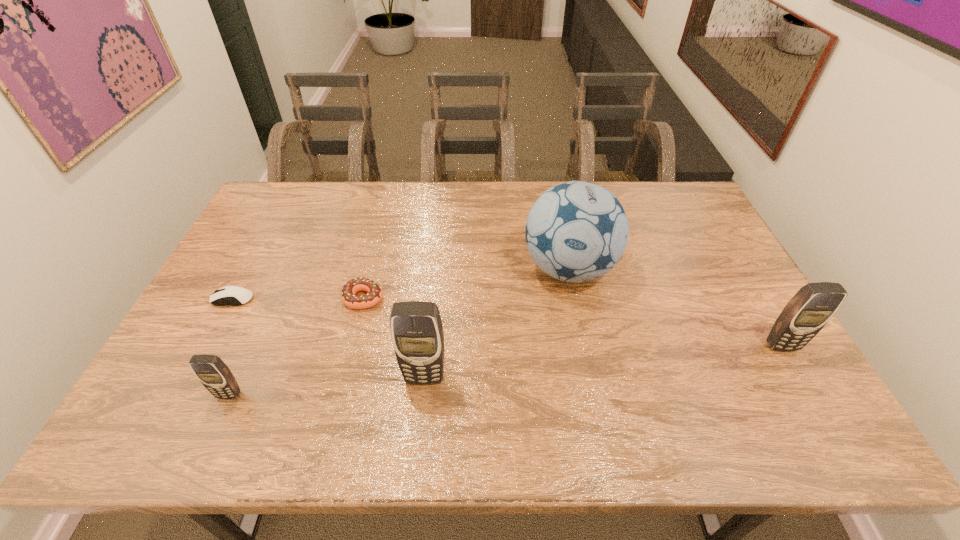
Find the location of `free point between the soccer ball and the leftmost object`. free point between the soccer ball and the leftmost object is located at coordinates (401, 284).

Where is `free space between the third shortest object and the fifth tallest object`? Image resolution: width=960 pixels, height=540 pixels. free space between the third shortest object and the fifth tallest object is located at coordinates (297, 346).

Where is `free space that is in between the second nearest object and the mouse`? This screenshot has height=540, width=960. free space that is in between the second nearest object and the mouse is located at coordinates (329, 338).

Locate which object is the fourth closest to the mouse. Please provide its 2D coordinates. Your answer should be formatted as a tuple, i.e. [(x, y)], where the tuple contains the x and y coordinates of a point satisfying the conditions above.

[(576, 231)]

Where is `object that is the second nearest to the second object from right to left`? The width and height of the screenshot is (960, 540). object that is the second nearest to the second object from right to left is located at coordinates (810, 309).

Identify which cellular telephone is located as the third nearest to the mouse. Please provide its 2D coordinates. Your answer should be formatted as a tuple, i.e. [(x, y)], where the tuple contains the x and y coordinates of a point satisfying the conditions above.

[(810, 309)]

I want to click on cellular telephone that is the closest to the rightmost object, so click(x=417, y=334).